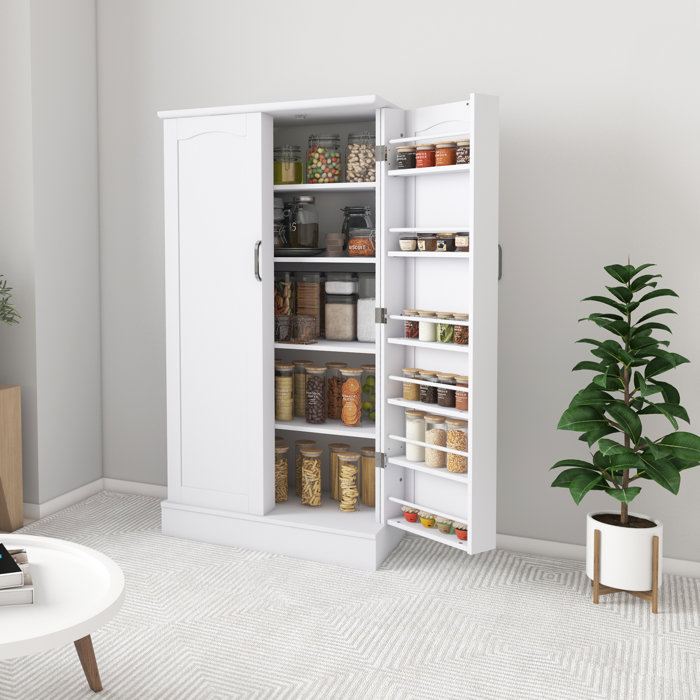
Locate an element on the screen. The image size is (700, 700). carpet squares is located at coordinates (98, 503), (153, 536), (284, 608), (220, 690), (54, 662), (532, 652), (558, 564).